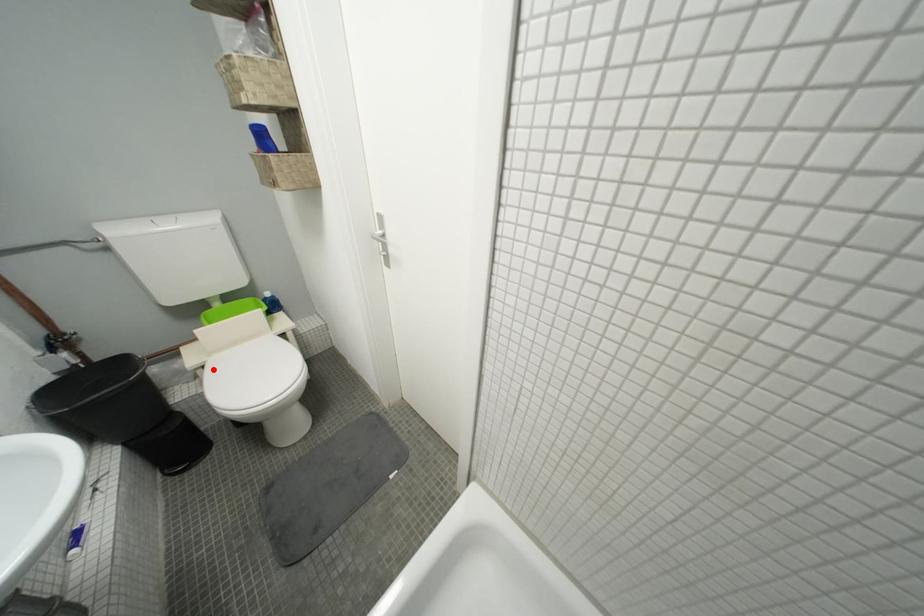
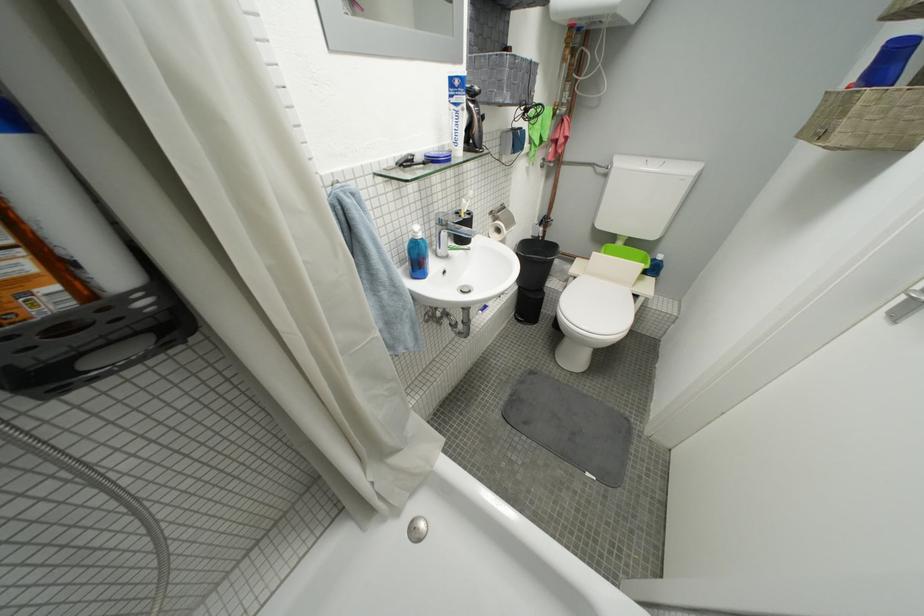
Question: I am providing you with two images of the same scene from different viewpoints. In image1, a red point is highlighted. Considering the same 3D point in image2, which of the following is correct?

Choices:
 (A) It is closer
 (B) It is farther

Answer: (A)